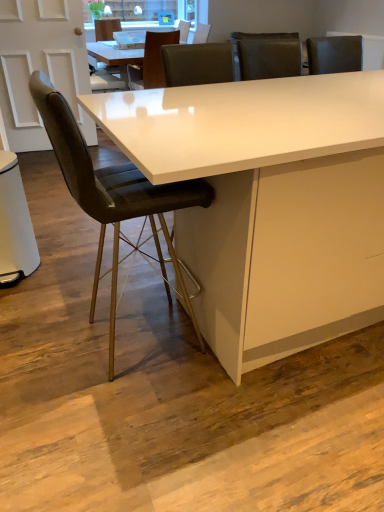
Question: Is leather-like black chair at left, the first chair from the front, looking in the opposite direction of white glossy table at center?

Choices:
 (A) no
 (B) yes

Answer: (B)

Question: Can you confirm if leather-like black chair at left, which is the 3th chair from top to bottom, is taller than white glossy table at center?

Choices:
 (A) yes
 (B) no

Answer: (A)

Question: Is leather-like black chair at left, positioned as the first chair in bottom-to-top order, thinner than white glossy table at center?

Choices:
 (A) no
 (B) yes

Answer: (B)

Question: Is leather-like black chair at left, arranged as the third chair when viewed from the back, surrounding white glossy table at center?

Choices:
 (A) no
 (B) yes

Answer: (A)

Question: Is leather-like black chair at left, the first chair from the front, bigger than white glossy table at center?

Choices:
 (A) yes
 (B) no

Answer: (B)

Question: Considering the positions of matte black chair at upper center, positioned as the third chair in front-to-back order, and white glossy table at center in the image, is matte black chair at upper center, positioned as the third chair in front-to-back order, bigger or smaller than white glossy table at center?

Choices:
 (A) small
 (B) big

Answer: (A)

Question: In the image, is matte black chair at upper center, the third chair in the bottom-to-top sequence, positioned in front of or behind white glossy table at center?

Choices:
 (A) behind
 (B) front

Answer: (A)

Question: From the image's perspective, is matte black chair at upper center, positioned as the third chair in front-to-back order, located above or below white glossy table at center?

Choices:
 (A) above
 (B) below

Answer: (A)

Question: Is matte black chair at upper center, the third chair in the bottom-to-top sequence, to the left or to the right of white glossy table at center in the image?

Choices:
 (A) left
 (B) right

Answer: (A)

Question: Considering the positions of leather-like black chair at left, which is the 3th chair from top to bottom, and leather at center, positioned as the 2th chair in top-to-bottom order, in the image, is leather-like black chair at left, which is the 3th chair from top to bottom, wider or thinner than leather at center, positioned as the 2th chair in top-to-bottom order,?

Choices:
 (A) wide
 (B) thin

Answer: (B)

Question: Is leather-like black chair at left, which is the 3th chair from top to bottom, spatially inside leather at center, the 2th chair from the front, or outside of it?

Choices:
 (A) outside
 (B) inside

Answer: (A)

Question: Looking at the image, does leather-like black chair at left, arranged as the third chair when viewed from the back, seem bigger or smaller compared to leather at center, the 2th chair in the bottom-to-top sequence?

Choices:
 (A) big
 (B) small

Answer: (A)

Question: From the image's perspective, is leather-like black chair at left, which is the 3th chair from top to bottom, positioned above or below leather at center, the 2th chair from the front?

Choices:
 (A) below
 (B) above

Answer: (A)

Question: Is matte black chair at upper center, positioned as the third chair in front-to-back order, inside the boundaries of leather-like black chair at left, arranged as the third chair when viewed from the back, or outside?

Choices:
 (A) inside
 (B) outside

Answer: (B)

Question: In terms of size, does matte black chair at upper center, which ranks as the 1th chair in top-to-bottom order, appear bigger or smaller than leather-like black chair at left, arranged as the third chair when viewed from the back?

Choices:
 (A) big
 (B) small

Answer: (B)